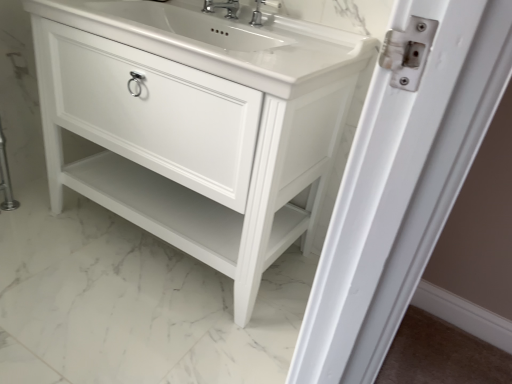
Question: Can you confirm if polished chrome faucet at upper center, which is the 1th tap from right to left, is smaller than polished chrome faucet at upper center, the first tap viewed from the left?

Choices:
 (A) no
 (B) yes

Answer: (B)

Question: From the image's perspective, would you say polished chrome faucet at upper center, which is the 1th tap from right to left, is shown under polished chrome faucet at upper center, the 2th tap from the right?

Choices:
 (A) yes
 (B) no

Answer: (A)

Question: Can we say polished chrome faucet at upper center, which is the 1th tap from right to left, lies outside polished chrome faucet at upper center, the first tap viewed from the left?

Choices:
 (A) no
 (B) yes

Answer: (B)

Question: Considering the relative sizes of polished chrome faucet at upper center, positioned as the 2th tap in left-to-right order, and polished chrome faucet at upper center, the first tap viewed from the left, in the image provided, is polished chrome faucet at upper center, positioned as the 2th tap in left-to-right order, wider than polished chrome faucet at upper center, the first tap viewed from the left,?

Choices:
 (A) no
 (B) yes

Answer: (A)

Question: From a real-world perspective, is polished chrome faucet at upper center, which is the 1th tap from right to left, physically below polished chrome faucet at upper center, the 2th tap from the right?

Choices:
 (A) no
 (B) yes

Answer: (B)

Question: Considering the positions of polished chrome faucet at upper center, positioned as the 2th tap in left-to-right order, and white glossy cabinet at center in the image, is polished chrome faucet at upper center, positioned as the 2th tap in left-to-right order, taller or shorter than white glossy cabinet at center?

Choices:
 (A) tall
 (B) short

Answer: (B)

Question: Is polished chrome faucet at upper center, positioned as the 2th tap in left-to-right order, wider or thinner than white glossy cabinet at center?

Choices:
 (A) wide
 (B) thin

Answer: (B)

Question: Considering the positions of polished chrome faucet at upper center, which is the 1th tap from right to left, and white glossy cabinet at center in the image, is polished chrome faucet at upper center, which is the 1th tap from right to left, bigger or smaller than white glossy cabinet at center?

Choices:
 (A) small
 (B) big

Answer: (A)

Question: From the image's perspective, relative to white glossy cabinet at center, is polished chrome faucet at upper center, which is the 1th tap from right to left, above or below?

Choices:
 (A) below
 (B) above

Answer: (B)

Question: Is polished chrome faucet at upper center, the 2th tap from the right, in front of or behind polished chrome faucet at upper center, which is the 1th tap from right to left, in the image?

Choices:
 (A) front
 (B) behind

Answer: (A)

Question: Looking at the image, does polished chrome faucet at upper center, the first tap viewed from the left, seem bigger or smaller compared to polished chrome faucet at upper center, which is the 1th tap from right to left?

Choices:
 (A) big
 (B) small

Answer: (A)

Question: From the image's perspective, is polished chrome faucet at upper center, the 2th tap from the right, above or below polished chrome faucet at upper center, positioned as the 2th tap in left-to-right order?

Choices:
 (A) below
 (B) above

Answer: (B)

Question: Is polished chrome faucet at upper center, the first tap viewed from the left, taller or shorter than polished chrome faucet at upper center, positioned as the 2th tap in left-to-right order?

Choices:
 (A) tall
 (B) short

Answer: (A)

Question: Do you think polished chrome faucet at upper center, the first tap viewed from the left, is within white glossy sink at center, or outside of it?

Choices:
 (A) inside
 (B) outside

Answer: (A)

Question: From a real-world perspective, is polished chrome faucet at upper center, the first tap viewed from the left, physically located above or below white glossy sink at center?

Choices:
 (A) below
 (B) above

Answer: (B)